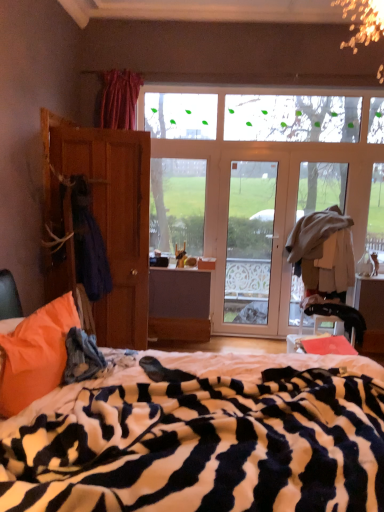
This screenshot has width=384, height=512. What do you see at coordinates (253, 246) in the screenshot?
I see `clear glass door at center` at bounding box center [253, 246].

This screenshot has height=512, width=384. Identify the location of clear glass door at center. (253, 246).

Image resolution: width=384 pixels, height=512 pixels. What do you see at coordinates (202, 436) in the screenshot? I see `zebra-patterned blanket at center` at bounding box center [202, 436].

Measure the distance between wooden wardrobe at left and camera.

Result: wooden wardrobe at left and camera are 10.32 feet apart.

The width and height of the screenshot is (384, 512). I want to click on wooden wardrobe at left, so click(106, 215).

Locate an element on the screen. dark blue fabric at left is located at coordinates coord(88,243).

This screenshot has height=512, width=384. What do you see at coordinates (36, 354) in the screenshot? I see `orange soft pillow at lower left` at bounding box center [36, 354].

Locate an element on the screen. blue fuzzy blanket at lower left is located at coordinates (82, 357).

Identify the location of black leather swivel chair at lower right. (337, 315).

Is the depth of wooden wardrobe at left less than that of black leather swivel chair at lower right?

Yes, wooden wardrobe at left is closer to the viewer.

Between point (129, 305) and point (341, 315), which one is positioned in front?

Point (129, 305)

From a real-world perspective, which object rests below the other?

black leather swivel chair at lower right, from a real-world perspective.

From a real-world perspective, is clear glass door at center positioned above or below wooden wardrobe at left?

In terms of real-world spatial position, clear glass door at center is below wooden wardrobe at left.

Based on the photo, considering their positions, is clear glass door at center located in front of or behind wooden wardrobe at left?

Clearly, clear glass door at center is behind wooden wardrobe at left.

Identify the location of door below the wooden wardrobe at left (from a real-world perspective). The height and width of the screenshot is (512, 384). (253, 246).

Which of these two, clear glass door at center or wooden wardrobe at left, is bigger?

Bigger between the two is wooden wardrobe at left.

Is clear glass door at center closer to the viewer compared to brown wooden screen door at left?

That is False.

Does point (230, 166) come farther from viewer compared to point (130, 208)?

Yes.

From the image's perspective, which one is positioned higher, clear glass door at center or brown wooden screen door at left?

clear glass door at center is shown above in the image.

Considering the sizes of clear glass door at center and brown wooden screen door at left in the image, is clear glass door at center wider or thinner than brown wooden screen door at left?

Considering their sizes, clear glass door at center looks slimmer than brown wooden screen door at left.

Can you confirm if orange soft pillow at lower left is bigger than blue fuzzy blanket at lower left?

Yes.

Is orange soft pillow at lower left aimed at blue fuzzy blanket at lower left?

Yes, orange soft pillow at lower left is aimed at blue fuzzy blanket at lower left.

Can you confirm if orange soft pillow at lower left is taller than blue fuzzy blanket at lower left?

Indeed, orange soft pillow at lower left has a greater height compared to blue fuzzy blanket at lower left.

Could blue fuzzy blanket at lower left be considered to be inside orange soft pillow at lower left?

No, blue fuzzy blanket at lower left is not inside orange soft pillow at lower left.

Is black leather swivel chair at lower right positioned far away from zebra-patterned blanket at center?

black leather swivel chair at lower right is far away from zebra-patterned blanket at center.

Consider the image. How many degrees apart are the facing directions of black leather swivel chair at lower right and zebra-patterned blanket at center?

87.6 degrees.

Based on the photo, considering the positions of objects black leather swivel chair at lower right and zebra-patterned blanket at center in the image provided, who is more to the left, black leather swivel chair at lower right or zebra-patterned blanket at center?

From the viewer's perspective, zebra-patterned blanket at center appears more on the left side.

Which object is closer to the camera taking this photo, black leather swivel chair at lower right or zebra-patterned blanket at center?

Positioned in front is zebra-patterned blanket at center.

In the image, is wooden wardrobe at left on the left side or the right side of orange soft pillow at lower left?

wooden wardrobe at left is positioned on orange soft pillow at lower left's left side.

How much distance is there between wooden wardrobe at left and orange soft pillow at lower left?

They are 1.36 meters apart.

This screenshot has height=512, width=384. Find the location of `armoire above the orange soft pillow at lower left (from the image's perspective)`. armoire above the orange soft pillow at lower left (from the image's perspective) is located at coordinates (106, 215).

Would you say wooden wardrobe at left contains orange soft pillow at lower left?

No, orange soft pillow at lower left is not inside wooden wardrobe at left.

In the scene shown: Is brown wooden screen door at left aimed at orange soft pillow at lower left?

No, brown wooden screen door at left is not oriented towards orange soft pillow at lower left.

The height and width of the screenshot is (512, 384). I want to click on pillow located underneath the brown wooden screen door at left (from a real-world perspective), so click(36, 354).

From the picture: Between brown wooden screen door at left and orange soft pillow at lower left, which one has larger width?

brown wooden screen door at left.

Where is `armoire on the left of black leather swivel chair at lower right`? Image resolution: width=384 pixels, height=512 pixels. armoire on the left of black leather swivel chair at lower right is located at coordinates (106, 215).

Locate an element on the screen. Image resolution: width=384 pixels, height=512 pixels. door on the right side of wooden wardrobe at left is located at coordinates (253, 246).

Based on their spatial positions, is dark blue fabric at left or orange soft pillow at lower left closer to brown wooden screen door at left?

Based on the image, dark blue fabric at left appears to be nearer to brown wooden screen door at left.

Based on their spatial positions, is clear glass door at center or dark blue fabric at left further from wooden wardrobe at left?

Among the two, clear glass door at center is located further to wooden wardrobe at left.

Which object lies further to the anchor point brown wooden screen door at left, clear glass door at center or blue fuzzy blanket at lower left?

clear glass door at center is further to brown wooden screen door at left.

Estimate the real-world distances between objects in this image. Which object is closer to dark blue fabric at left, black leather swivel chair at lower right or brown wooden screen door at left?

brown wooden screen door at left.

Estimate the real-world distances between objects in this image. Which object is further from brown wooden screen door at left, zebra-patterned blanket at center or blue fuzzy blanket at lower left?

zebra-patterned blanket at center is positioned further to the anchor brown wooden screen door at left.

Which object lies nearer to the anchor point blue fuzzy blanket at lower left, orange soft pillow at lower left or zebra-patterned blanket at center?

orange soft pillow at lower left is closer to blue fuzzy blanket at lower left.

Looking at this image, when comparing their distances from clear glass door at center, does dark blue fabric at left or wooden wardrobe at left seem further?

Among the two, dark blue fabric at left is located further to clear glass door at center.

From the image, which object appears to be nearer to zebra-patterned blanket at center, blue fuzzy blanket at lower left or wooden wardrobe at left?

blue fuzzy blanket at lower left is closer to zebra-patterned blanket at center.

At what (x,y) coordinates should I click in order to perform the action: click on cloth between zebra-patterned blanket at center and clear glass door at center along the z-axis. Please return your answer as a coordinate pair (x, y). This screenshot has height=512, width=384. Looking at the image, I should click on (82, 357).

Locate an element on the screen. laundry located between zebra-patterned blanket at center and brown wooden screen door at left in the depth direction is located at coordinates (88, 243).

The width and height of the screenshot is (384, 512). What are the coordinates of `screen door between dark blue fabric at left and clear glass door at center from left to right` in the screenshot? It's located at point(125,239).

This screenshot has height=512, width=384. I want to click on door located between brown wooden screen door at left and black leather swivel chair at lower right in the left-right direction, so click(x=253, y=246).